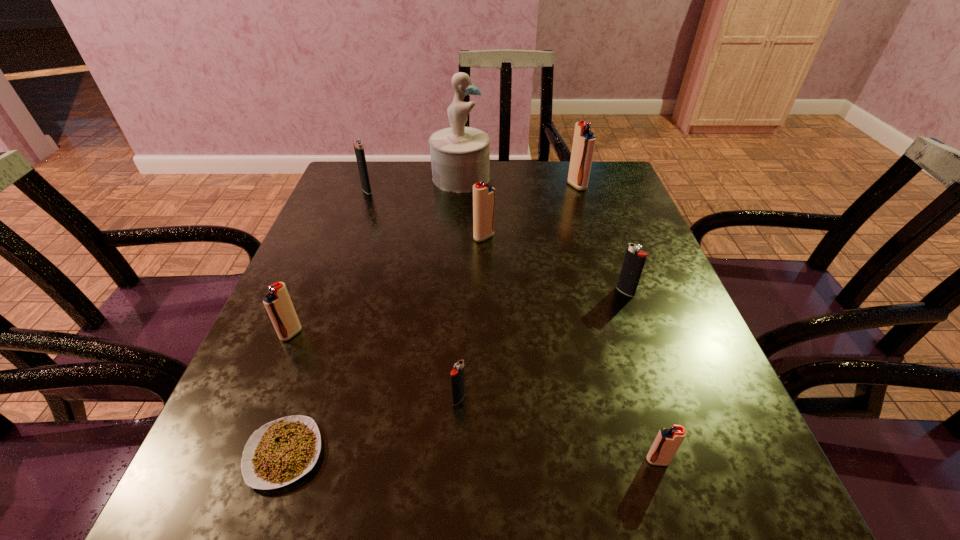
Find the location of a particular element. free region located on the right of the second igniter from left to right is located at coordinates (420, 190).

This screenshot has width=960, height=540. I want to click on blank space located 0.090m on the left of the rightmost black igniter, so pos(574,292).

I want to click on vacant space located on the front of the leftmost igniter, so click(x=264, y=399).

Where is `vacant space located on the left of the nearest igniter`? vacant space located on the left of the nearest igniter is located at coordinates (558, 461).

This screenshot has height=540, width=960. In order to click on vacant space situated on the front of the nearest black igniter in this screenshot , I will do `click(456, 473)`.

Find the location of `vacant point located on the back of the shortest object`. vacant point located on the back of the shortest object is located at coordinates (343, 282).

This screenshot has height=540, width=960. Identify the location of figurine positioned at the far edge. (460, 156).

Locate an element on the screen. object positioned at the near edge is located at coordinates (280, 452).

The width and height of the screenshot is (960, 540). Identify the location of legume that is at the left edge. (280, 452).

Identify the location of object at the far left corner. The width and height of the screenshot is (960, 540). (358, 144).